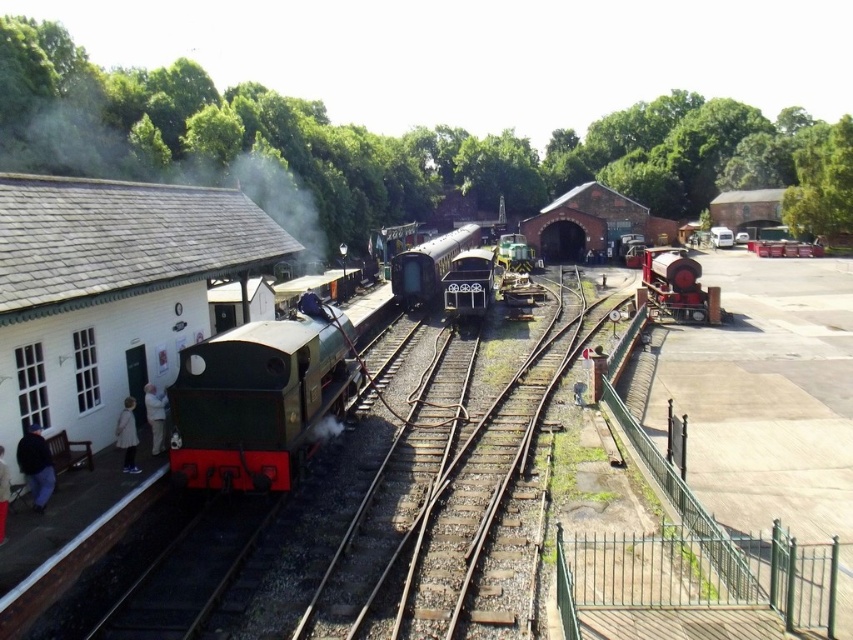
Describe the element at coordinates (36, 465) in the screenshot. I see `dark blue jacket at lower left` at that location.

Locate an element on the screen. This screenshot has width=853, height=640. dark blue jacket at lower left is located at coordinates (36, 465).

From the picture: Is green polished wood train at left shorter than white cotton shirt at lower left?

No.

Can you confirm if green polished wood train at left is positioned to the right of white cotton shirt at lower left?

Correct, you'll find green polished wood train at left to the right of white cotton shirt at lower left.

Is point (277, 426) more distant than point (160, 449)?

No.

This screenshot has width=853, height=640. I want to click on green polished wood train at left, so click(x=260, y=397).

Who is taller, gray slate roof at upper left or white fabric jacket at lower left?

gray slate roof at upper left

Does gray slate roof at upper left have a lesser width compared to white fabric jacket at lower left?

No.

I want to click on gray slate roof at upper left, so click(164, 168).